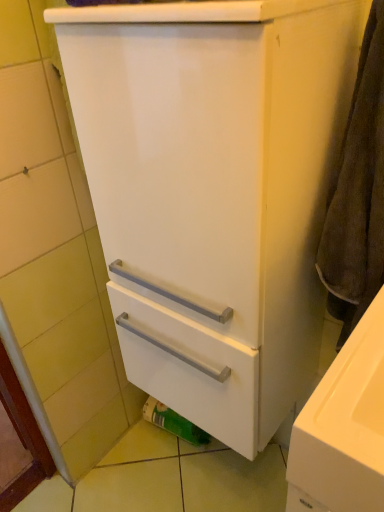
Question: From the image's perspective, would you say green matte toilet paper at lower center is positioned over brown textured towel at right?

Choices:
 (A) yes
 (B) no

Answer: (B)

Question: Does green matte toilet paper at lower center have a greater width compared to brown textured towel at right?

Choices:
 (A) yes
 (B) no

Answer: (B)

Question: Does green matte toilet paper at lower center have a smaller size compared to brown textured towel at right?

Choices:
 (A) no
 (B) yes

Answer: (B)

Question: Considering the relative positions of green matte toilet paper at lower center and brown textured towel at right in the image provided, is green matte toilet paper at lower center behind brown textured towel at right?

Choices:
 (A) no
 (B) yes

Answer: (B)

Question: Is green matte toilet paper at lower center bigger than brown textured towel at right?

Choices:
 (A) yes
 (B) no

Answer: (B)

Question: Considering the relative positions of green matte toilet paper at lower center and brown textured towel at right in the image provided, is green matte toilet paper at lower center in front of brown textured towel at right?

Choices:
 (A) yes
 (B) no

Answer: (B)

Question: From a real-world perspective, is brown textured towel at right located beneath green matte toilet paper at lower center?

Choices:
 (A) yes
 (B) no

Answer: (B)

Question: Is brown textured towel at right with green matte toilet paper at lower center?

Choices:
 (A) no
 (B) yes

Answer: (A)

Question: From the image's perspective, is brown textured towel at right located beneath green matte toilet paper at lower center?

Choices:
 (A) yes
 (B) no

Answer: (B)

Question: Can you confirm if brown textured towel at right is shorter than green matte toilet paper at lower center?

Choices:
 (A) yes
 (B) no

Answer: (B)

Question: Can you confirm if brown textured towel at right is bigger than green matte toilet paper at lower center?

Choices:
 (A) yes
 (B) no

Answer: (A)

Question: From a real-world perspective, is brown textured towel at right positioned over green matte toilet paper at lower center based on gravity?

Choices:
 (A) no
 (B) yes

Answer: (B)

Question: Is green matte toilet paper at lower center to the left or to the right of brown textured towel at right in the image?

Choices:
 (A) left
 (B) right

Answer: (A)